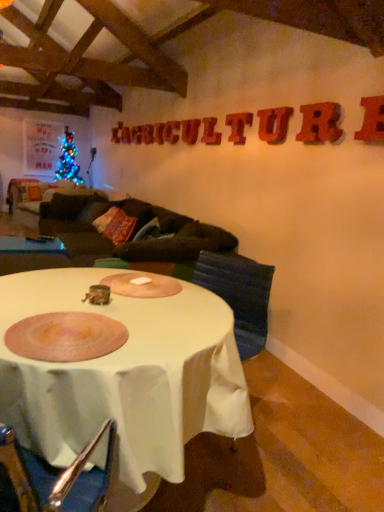
The height and width of the screenshot is (512, 384). Find the location of `empty space that is ontop of white cloth-covered table at center, positioned as the 1th table in right-to-left order (from a real-world perspective)`. empty space that is ontop of white cloth-covered table at center, positioned as the 1th table in right-to-left order (from a real-world perspective) is located at coordinates (114, 311).